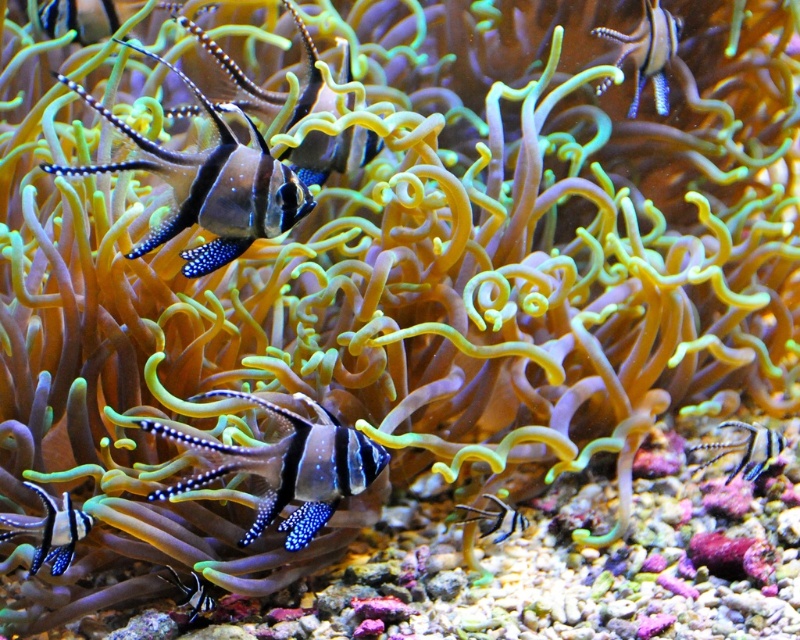
Question: Estimate the real-world distances between objects in this image. Which object is farther from the matte black fish at upper left?

Choices:
 (A) shiny blue and black fish at center
 (B) black glossy fish at center
 (C) shiny blue and black striped fish at bottom left
 (D) black glossy fish at lower left

Answer: (B)

Question: Does shiny blue and black fish at upper left lie behind matte black fish at upper left?

Choices:
 (A) no
 (B) yes

Answer: (A)

Question: Among these objects, which one is nearest to the camera?

Choices:
 (A) shiny blue and black fish at center
 (B) blue dotted fin at upper right

Answer: (A)

Question: Considering the real-world distances, which object is farthest from the shiny blue and black striped fish at center?

Choices:
 (A) shiny blue and black fish at center
 (B) black glossy fish at lower left

Answer: (B)

Question: Observing the image, what is the correct spatial positioning of shiny blue and black fish at center in reference to matte black fish at upper left?

Choices:
 (A) below
 (B) above

Answer: (A)

Question: Is shiny blue and black fish at center further to the viewer compared to black glossy fish at center?

Choices:
 (A) no
 (B) yes

Answer: (A)